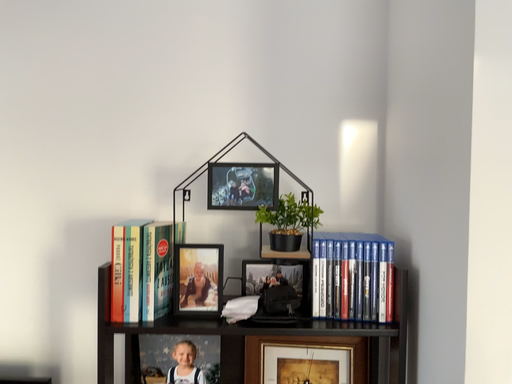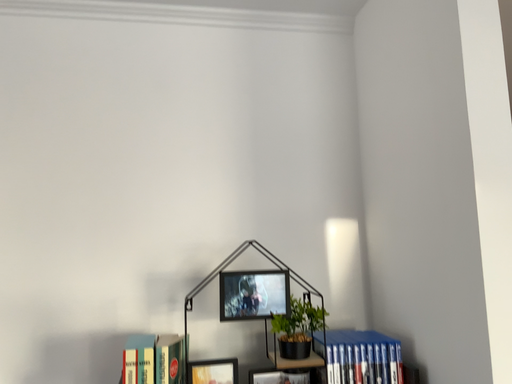
Question: How did the camera likely rotate when shooting the video?

Choices:
 (A) rotated left
 (B) rotated right

Answer: (B)